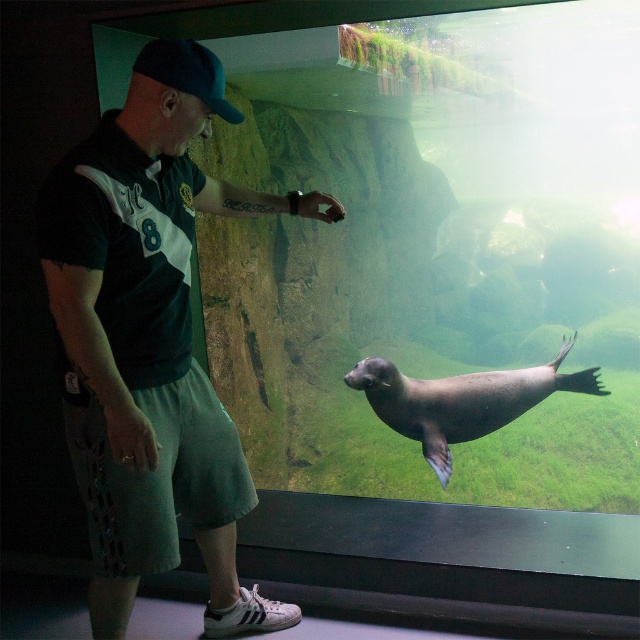
Is dark green jersey at center bigger than smooth gray seal at center?

Yes.

Can you confirm if dark green jersey at center is positioned to the left of smooth gray seal at center?

Correct, you'll find dark green jersey at center to the left of smooth gray seal at center.

The height and width of the screenshot is (640, 640). I want to click on dark green jersey at center, so click(150, 339).

Find the location of a particular element. The width and height of the screenshot is (640, 640). dark green jersey at center is located at coordinates (150, 339).

Does smooth gray seal at center appear under dark blue fabric baseball cap at upper left?

Yes, smooth gray seal at center is below dark blue fabric baseball cap at upper left.

Which of these two, smooth gray seal at center or dark blue fabric baseball cap at upper left, stands shorter?

dark blue fabric baseball cap at upper left is shorter.

Which is behind, point (404, 426) or point (157, 52)?

Positioned behind is point (404, 426).

I want to click on smooth gray seal at center, so click(x=461, y=401).

Does point (124, 141) come farther from viewer compared to point (209, 81)?

No, it is in front of (209, 81).

Describe the element at coordinates (150, 339) in the screenshot. The height and width of the screenshot is (640, 640). I see `dark green jersey at center` at that location.

Is point (163, 554) farther from viewer compared to point (221, 99)?

Yes, it is.

What are the coordinates of `dark green jersey at center` in the screenshot? It's located at (150, 339).